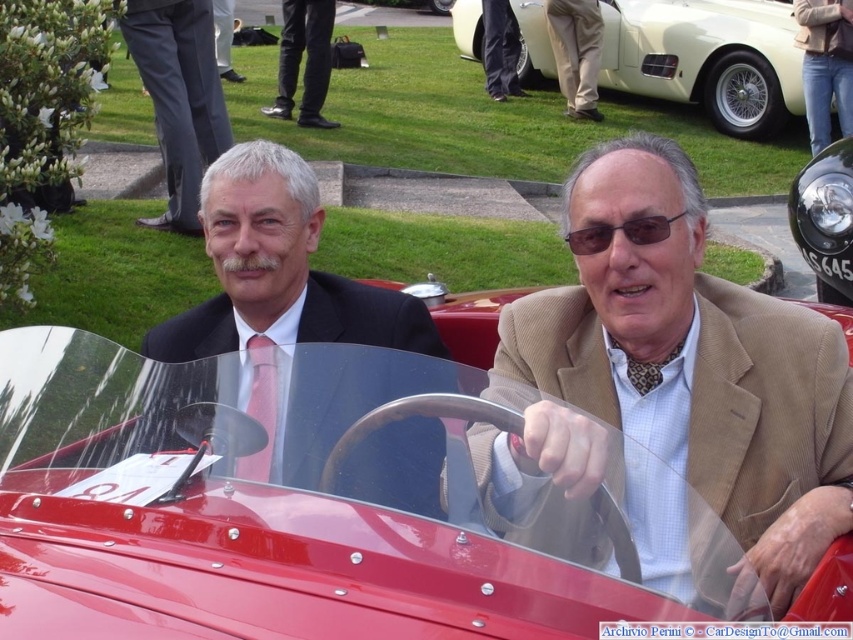
Question: Among these objects, which one is nearest to the camera?

Choices:
 (A) glossy red car at center
 (B) tan fabric pants at center
 (C) tan textured blazer at center
 (D) dark brown textured sunglasses at center

Answer: (A)

Question: Is white glossy car at upper right behind tan fabric pants at center?

Choices:
 (A) yes
 (B) no

Answer: (B)

Question: Which of these objects is positioned closest to the matte black suit at center?

Choices:
 (A) black leather shoes at center
 (B) white glossy car at upper right

Answer: (A)

Question: Which object is positioned farthest from the black leather shoes at center?

Choices:
 (A) tan fabric pants at center
 (B) matte black suit at center
 (C) white glossy car at upper right
 (D) black metal headlight at center

Answer: (B)

Question: Does glossy red car at center appear on the left side of black leather shoes at center?

Choices:
 (A) yes
 (B) no

Answer: (B)

Question: Is the position of tan textured blazer at center less distant than that of gray suit at center?

Choices:
 (A) no
 (B) yes

Answer: (B)